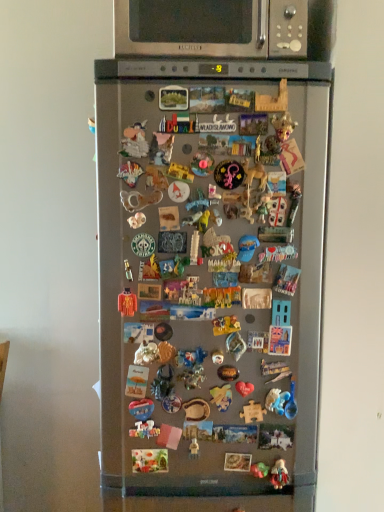
Question: In terms of width, does satin silver microwave at upper center look wider or thinner when compared to orange fabric toy at center, arranged as the 4th toy when ordered from the bottom?

Choices:
 (A) wide
 (B) thin

Answer: (A)

Question: Is point (291, 51) closer or farther from the camera than point (132, 309)?

Choices:
 (A) closer
 (B) farther

Answer: (B)

Question: Which object is positioned farthest from the satin silver fridge at center?

Choices:
 (A) matte plastic figurine at lower center, the 4th toy when ordered from left to right
 (B) metallic gold figurine at center, the 3th toy when ordered from right to left
 (C) satin silver microwave at upper center
 (D) orange fabric toy at center, which ranks as the first toy in top-to-bottom order
 (E) wooden puzzle piece at center, the 3th toy ordered from the bottom

Answer: (A)

Question: Based on their relative distances, which object is nearer to the satin silver fridge at center?

Choices:
 (A) matte plastic figurine at lower center, the 4th toy from the top
 (B) satin silver microwave at upper center
 (C) wooden puzzle piece at center, the 2th toy from the top
 (D) metallic gold figurine at center, the 2th toy in the bottom-to-top sequence
 (E) orange fabric toy at center, arranged as the 4th toy when ordered from the bottom

Answer: (E)